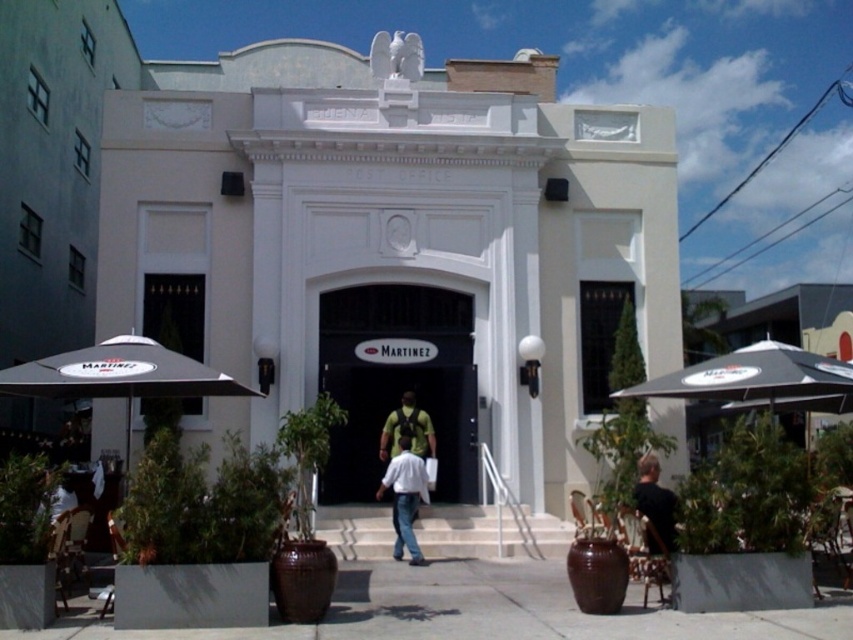
Does black matte door at center have a larger size compared to white cotton shirt at center?

Indeed, black matte door at center has a larger size compared to white cotton shirt at center.

Does black matte door at center appear on the right side of white cotton shirt at center?

Incorrect, black matte door at center is not on the right side of white cotton shirt at center.

Where is `black matte door at center`? This screenshot has height=640, width=853. black matte door at center is located at coordinates (397, 381).

Can you confirm if smooth concrete pavement at center is wider than black matte door at center?

Incorrect, smooth concrete pavement at center's width does not surpass black matte door at center's.

Is smooth concrete pavement at center closer to the viewer compared to black matte door at center?

Yes, smooth concrete pavement at center is in front of black matte door at center.

Identify the location of smooth concrete pavement at center. coord(488,611).

Find the location of a particular element. smooth concrete pavement at center is located at coordinates [x=488, y=611].

From the picture: Is smooth concrete pavement at center smaller than white cotton shirt at center?

Yes, smooth concrete pavement at center is smaller than white cotton shirt at center.

Does point (409, 595) lie behind point (379, 497)?

No, (409, 595) is closer to viewer.

Locate an element on the screen. This screenshot has height=640, width=853. smooth concrete pavement at center is located at coordinates (488, 611).

In order to click on smooth concrete pavement at center in this screenshot , I will do `click(488, 611)`.